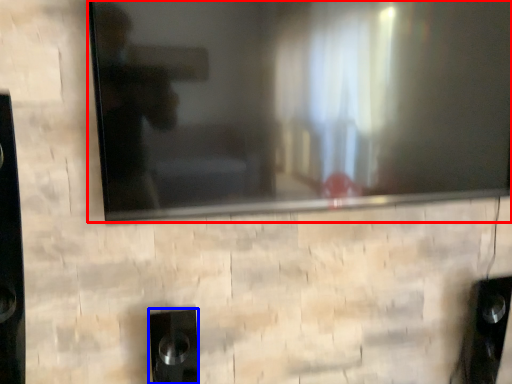
Question: Which object appears farthest to the camera in this image, television (highlighted by a red box) or speaker (highlighted by a blue box)?

Choices:
 (A) television
 (B) speaker

Answer: (B)